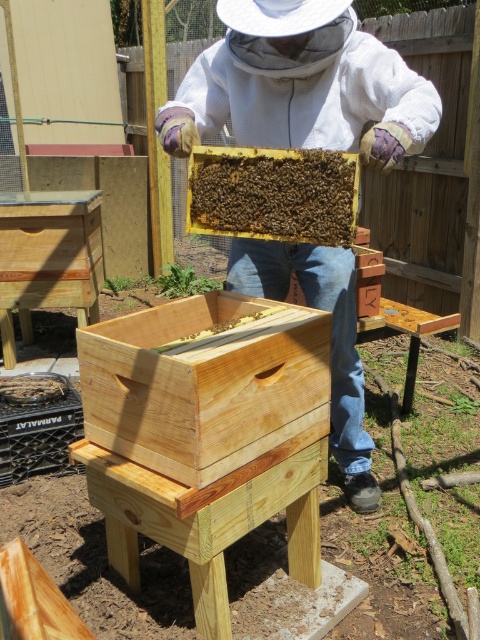
Question: Observing the image, what is the correct spatial positioning of white fabric beekeeper suit at center in reference to brown wooden beehive at center?

Choices:
 (A) left
 (B) right

Answer: (B)

Question: Can you confirm if white fabric beekeeper suit at center is positioned below brown wooden beehive at center?

Choices:
 (A) yes
 (B) no

Answer: (B)

Question: Which object is positioned closest to the brown wooden bee at center?

Choices:
 (A) brown wooden beehive at center
 (B) white fabric beekeeper suit at center

Answer: (A)

Question: Which of these objects is positioned farthest from the brown wooden bee at center?

Choices:
 (A) brown wooden beehive at center
 (B) white fabric beekeeper suit at center
 (C) natural wood beehive at center

Answer: (B)

Question: Does white fabric beekeeper suit at center have a larger size compared to brown wooden bee at center?

Choices:
 (A) no
 (B) yes

Answer: (B)

Question: Which point is farther to the camera?

Choices:
 (A) (239, 320)
 (B) (267, 157)

Answer: (A)